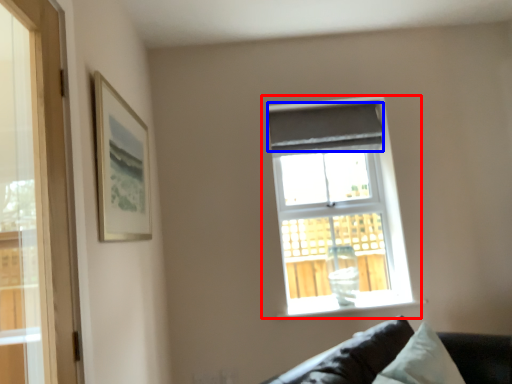
Question: Which object is closer to the camera taking this photo, window (highlighted by a red box) or curtain (highlighted by a blue box)?

Choices:
 (A) window
 (B) curtain

Answer: (A)